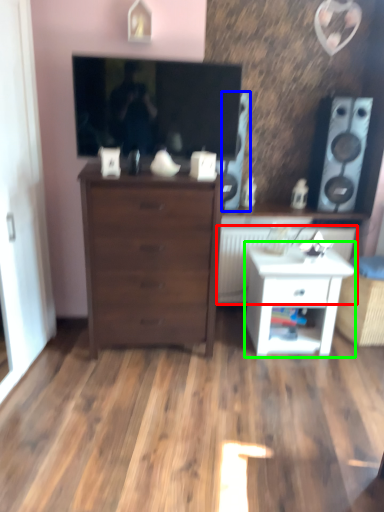
Question: Which object is positioned farthest from radiator (highlighted by a red box)? Select from speaker (highlighted by a blue box) and nightstand (highlighted by a green box).

Choices:
 (A) speaker
 (B) nightstand

Answer: (A)